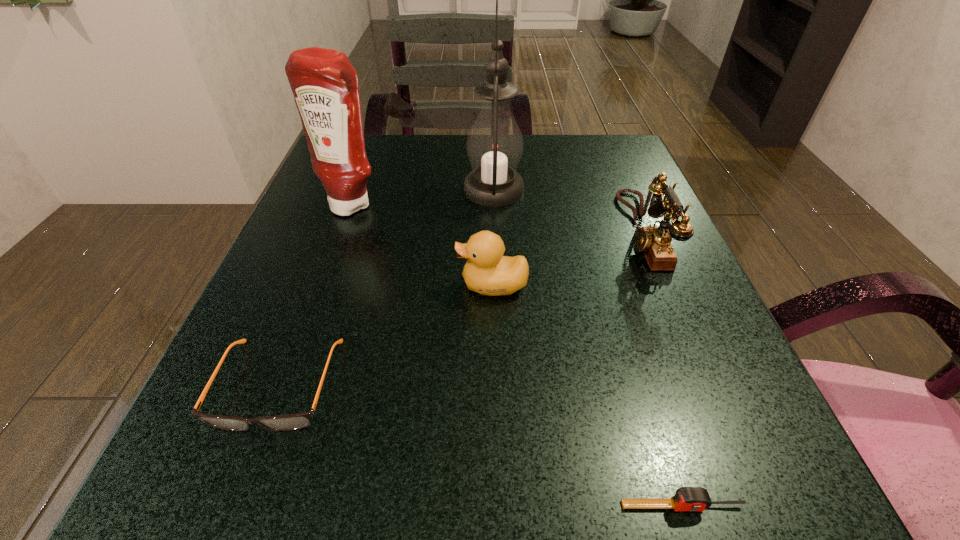
Find the location of a particular element. oil lamp is located at coordinates (494, 145).

The height and width of the screenshot is (540, 960). What are the coordinates of `the second tallest object` in the screenshot? It's located at (325, 85).

Where is `the fourth shortest object`? This screenshot has width=960, height=540. the fourth shortest object is located at coordinates (654, 242).

Image resolution: width=960 pixels, height=540 pixels. What are the coordinates of `duckling` in the screenshot? It's located at (487, 272).

What are the coordinates of `the second nearest object` in the screenshot? It's located at (300, 420).

You are a GUI agent. You are given a task and a screenshot of the screen. Output one action in this format:
    pyautogui.click(x=<x>, y=<y>)
    Task: Click on the spectacles
    Image resolution: width=960 pixels, height=540 pixels.
    Given the screenshot: What is the action you would take?
    pyautogui.click(x=300, y=420)

Where is `the nearest object`? the nearest object is located at coordinates (686, 498).

Where is `tape measure`? The width and height of the screenshot is (960, 540). tape measure is located at coordinates (686, 498).

Locate an element on the screen. The height and width of the screenshot is (540, 960). vacant space located 0.160m on the front of the oil lamp is located at coordinates (497, 267).

This screenshot has width=960, height=540. I want to click on vacant space located on the front of the second tallest object, so click(320, 296).